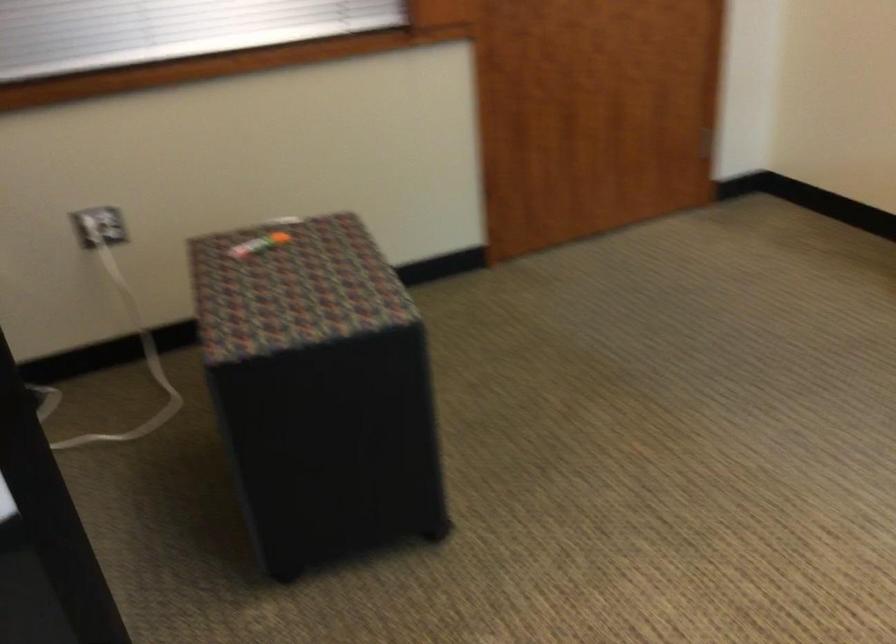
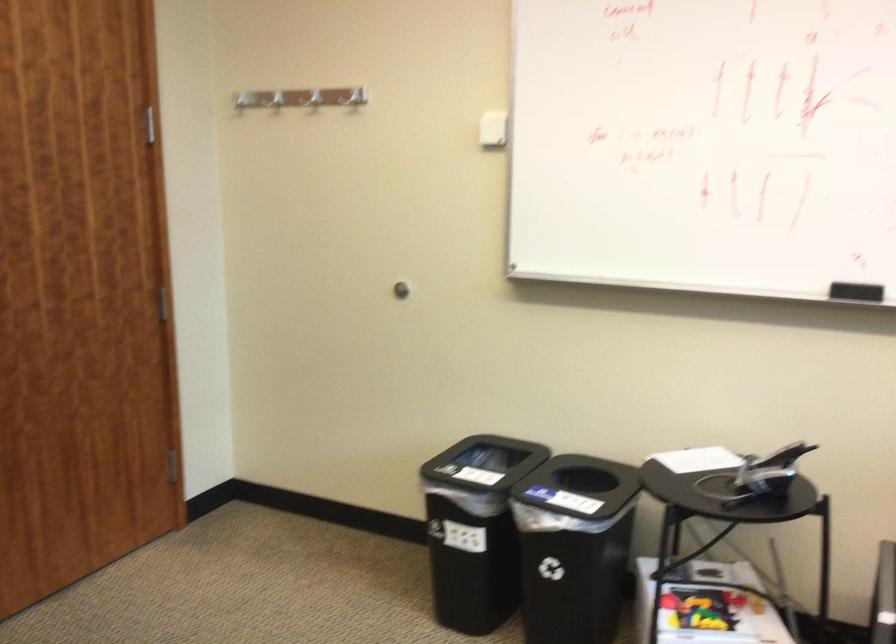
Question: The camera is either moving clockwise (left) or counter-clockwise (right) around the object. The first image is from the beginning of the video and the second image is from the end. Is the camera moving left or right when shooting the video?

Choices:
 (A) Left
 (B) Right

Answer: (A)